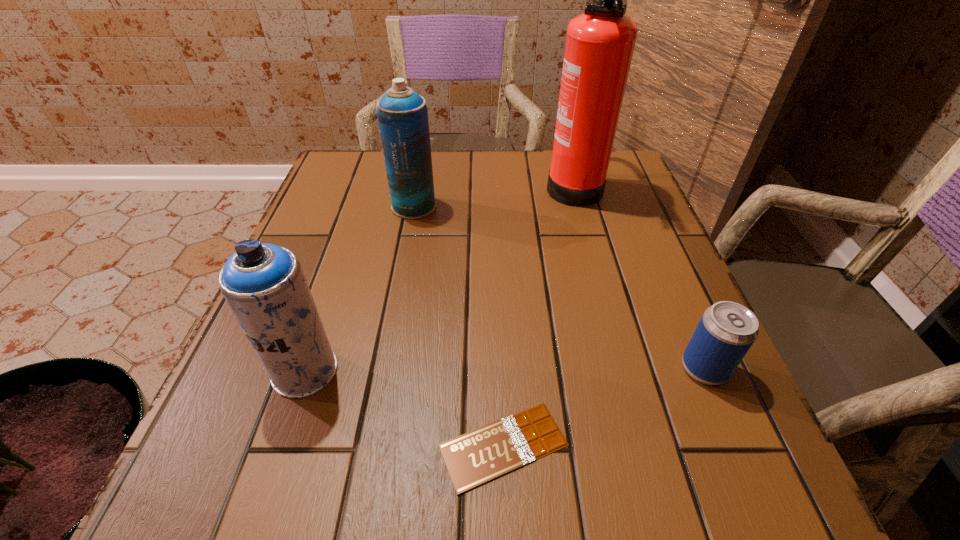
Identify the location of empty location between the left aerosol can and the fourth object from left to right. The image size is (960, 540). (439, 277).

You are a GUI agent. You are given a task and a screenshot of the screen. Output one action in this format:
    pyautogui.click(x=<x>, y=<y>)
    Task: Click on the free space between the third object from right to left and the fourth object from left to right
    
    Given the screenshot: What is the action you would take?
    pyautogui.click(x=539, y=314)

Locate an element on the screen. This screenshot has width=960, height=540. free space between the leftmost object and the fourth object from right to left is located at coordinates (359, 288).

Find the location of a particular element. unoccupied area between the nearest object and the fourth object from left to right is located at coordinates (539, 314).

The height and width of the screenshot is (540, 960). What are the coordinates of `free space between the rightmost object and the fire extinguisher` in the screenshot? It's located at pyautogui.click(x=638, y=276).

At what (x,y) coordinates should I click in order to perform the action: click on free spot between the fourth tallest object and the second object from left to right. Please return your answer as a coordinate pair (x, y). This screenshot has height=540, width=960. Looking at the image, I should click on (559, 287).

The image size is (960, 540). Identify the location of empty location between the chocolate bar and the nearer aerosol can. (404, 408).

This screenshot has height=540, width=960. I want to click on vacant region between the second object from left to right and the third object from left to right, so click(459, 326).

Where is `free space between the second object from left to right and the third object from left to right`? The width and height of the screenshot is (960, 540). free space between the second object from left to right and the third object from left to right is located at coordinates (459, 326).

Select which object appears as the closest to the second object from left to right. Please provide its 2D coordinates. Your answer should be formatted as a tuple, i.e. [(x, y)], where the tuple contains the x and y coordinates of a point satisfying the conditions above.

[(600, 42)]